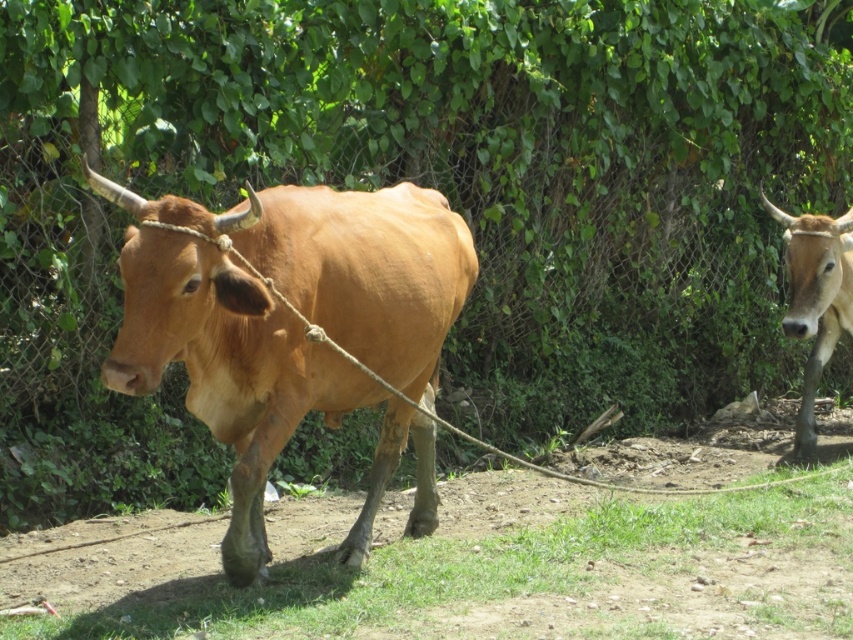
Does green grass at lower center lie in front of shiny brown bull at center?

No, it is behind shiny brown bull at center.

Between green grass at lower center and shiny brown bull at center, which one is positioned higher?

shiny brown bull at center

Does point (602, 616) lie behind point (355, 307)?

That is False.

Locate an element on the screen. green grass at lower center is located at coordinates (508, 577).

Does point (338, 397) come farther from viewer compared to point (839, 262)?

No, (338, 397) is in front of (839, 262).

Can you confirm if shiny brown bull at center is shorter than brown glossy cow at right?

No.

Find the location of a particular element. This screenshot has width=853, height=640. shiny brown bull at center is located at coordinates (250, 381).

Can you confirm if green grass at lower center is taller than brown glossy cow at right?

Incorrect, green grass at lower center's height is not larger of brown glossy cow at right's.

Which of these two, green grass at lower center or brown glossy cow at right, stands taller?

Standing taller between the two is brown glossy cow at right.

Does point (628, 538) come farther from viewer compared to point (786, 310)?

No, it is in front of (786, 310).

The width and height of the screenshot is (853, 640). I want to click on green grass at lower center, so click(x=508, y=577).